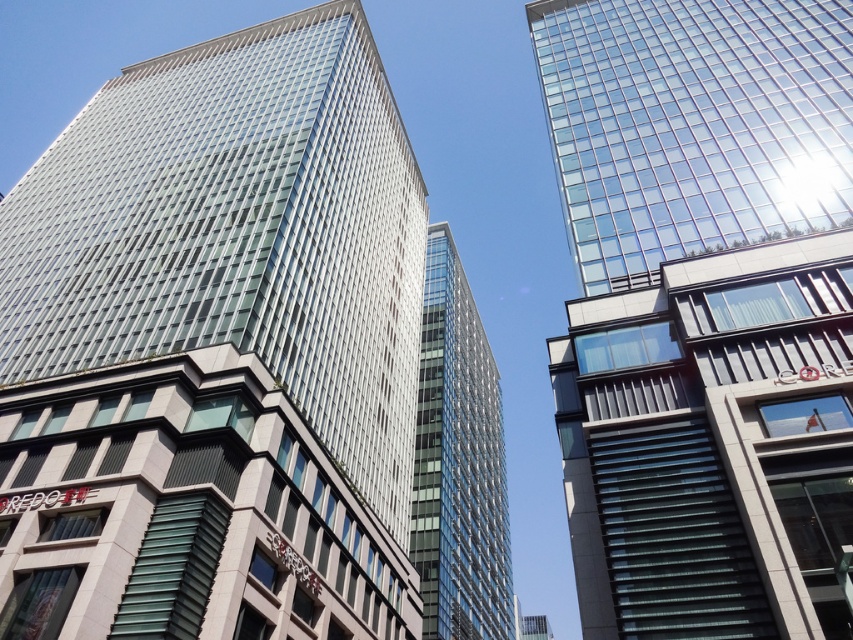
Question: Which object is farther from the camera taking this photo?

Choices:
 (A) transparent glass building at center
 (B) transparent glass tower at upper center

Answer: (A)

Question: Does transparent glass building at center have a larger size compared to transparent glass tower at center?

Choices:
 (A) no
 (B) yes

Answer: (B)

Question: Does transparent glass building at center lie in front of transparent glass tower at upper center?

Choices:
 (A) yes
 (B) no

Answer: (B)

Question: Which object appears farthest from the camera in this image?

Choices:
 (A) transparent glass tower at upper center
 (B) transparent glass building at center
 (C) transparent glass tower at center

Answer: (C)

Question: Does transparent glass building at center appear on the right side of transparent glass tower at upper center?

Choices:
 (A) yes
 (B) no

Answer: (B)

Question: Which object is the farthest from the transparent glass tower at upper center?

Choices:
 (A) transparent glass tower at center
 (B) transparent glass building at center

Answer: (A)